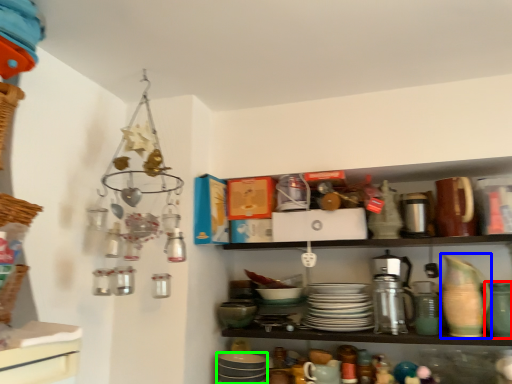
Question: Which object is positioned closest to tableware (highlighted by a red box)? Select from tableware (highlighted by a blue box) and tableware (highlighted by a green box).

Choices:
 (A) tableware
 (B) tableware

Answer: (A)